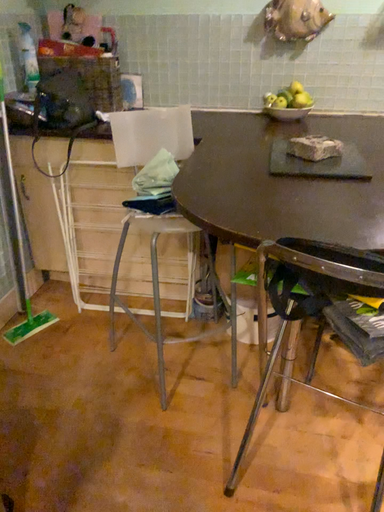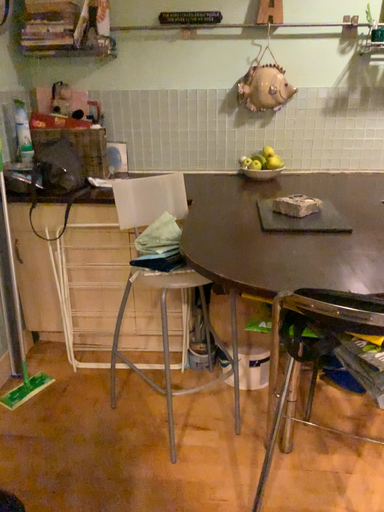
Question: How did the camera likely rotate when shooting the video?

Choices:
 (A) rotated upward
 (B) rotated downward

Answer: (A)